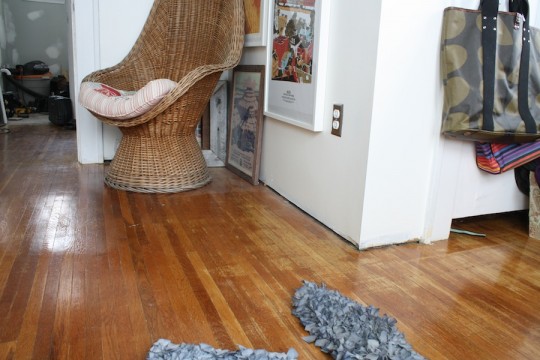
Where is `light pink and white cushion`? This screenshot has width=540, height=360. light pink and white cushion is located at coordinates (127, 106).